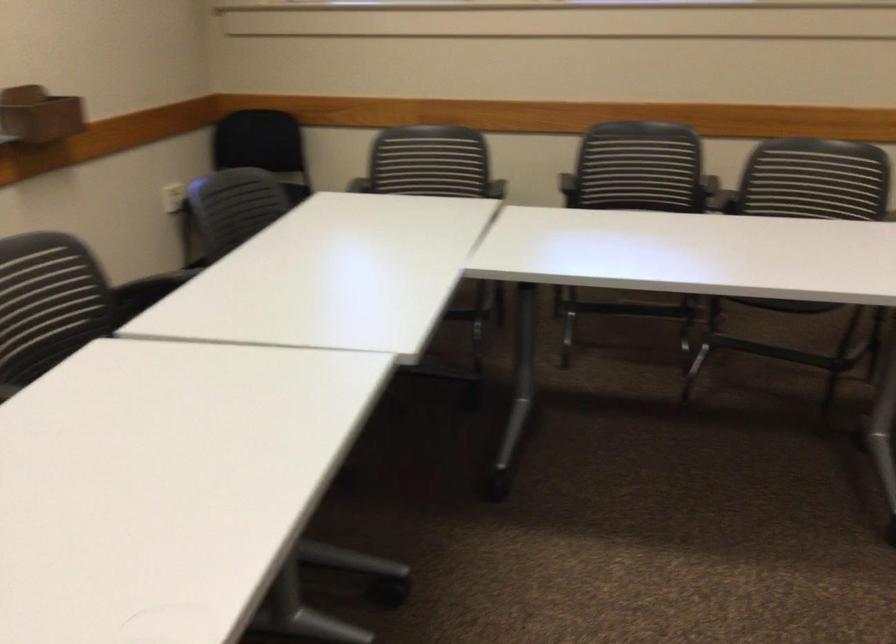
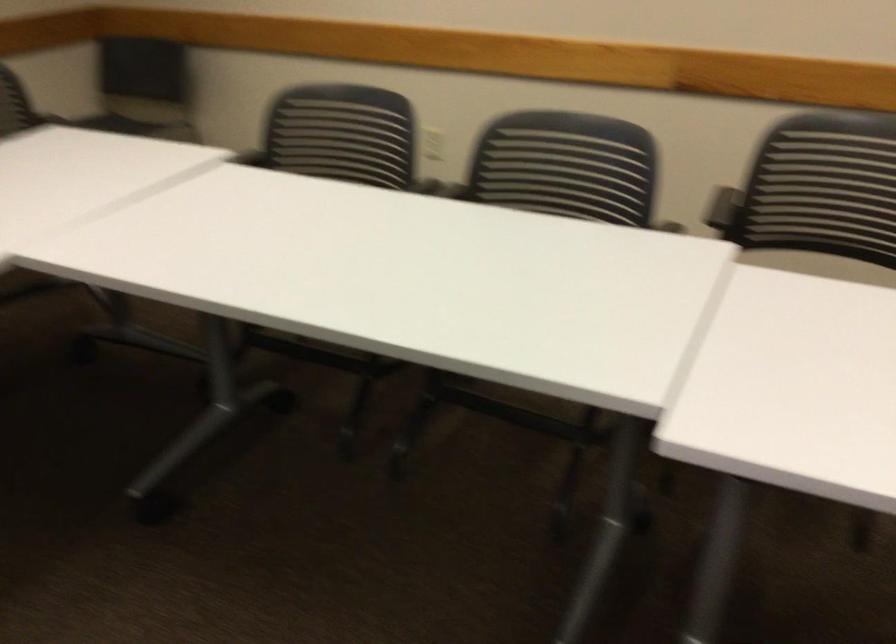
Based on the continuous images, in which direction is the camera rotating?

The camera's rotation is toward right-down.